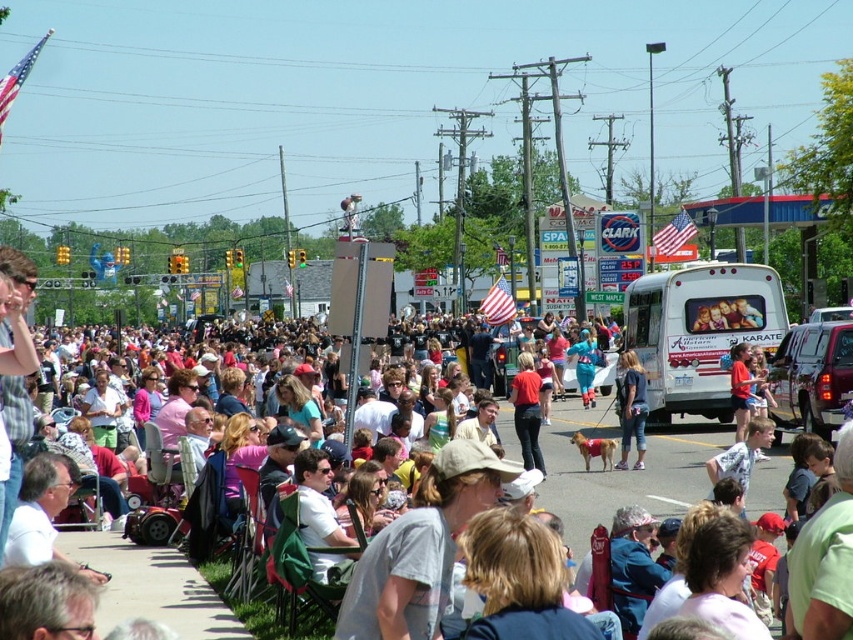
Question: Considering the real-world distances, which object is closest to the light brown dog at center?

Choices:
 (A) white matte van at center
 (B) red fabric dog at center
 (C) red cotton shirt at center
 (D) matte red shirt at center

Answer: (C)

Question: Estimate the real-world distances between objects in this image. Which object is farther from the matte red shirt at center?

Choices:
 (A) white matte van at center
 (B) red cotton shirt at center
 (C) light brown dog at center
 (D) red fabric dog at center

Answer: (D)

Question: Does light brown dog at center appear on the right side of matte red shirt at center?

Choices:
 (A) yes
 (B) no

Answer: (B)

Question: Is red cotton shirt at center positioned in front of matte red shirt at center?

Choices:
 (A) no
 (B) yes

Answer: (B)

Question: Which is nearer to the red fabric dog at center?

Choices:
 (A) red cotton shirt at center
 (B) white matte van at center
 (C) matte red shirt at center

Answer: (C)

Question: Can you confirm if red fabric dog at center is positioned below light brown dog at center?

Choices:
 (A) yes
 (B) no

Answer: (B)